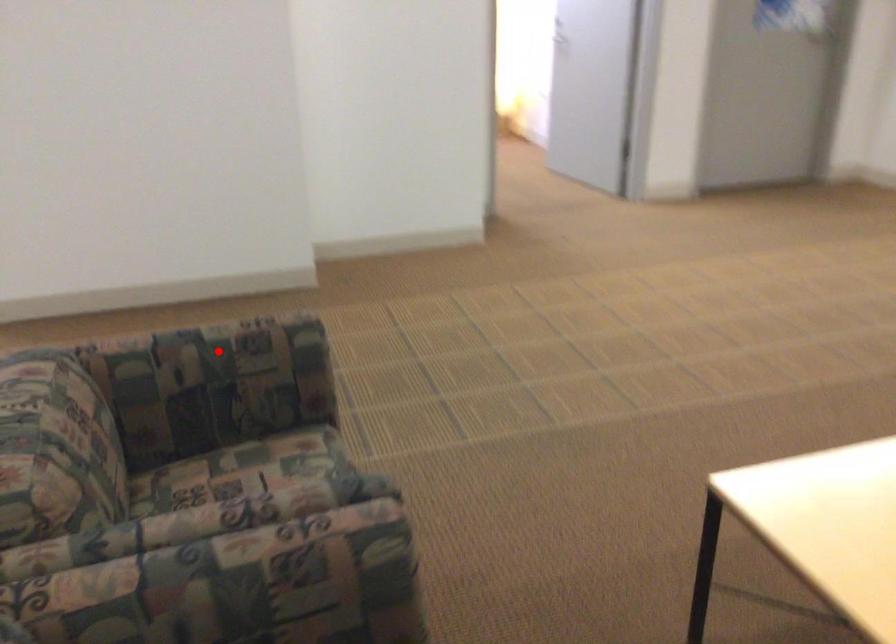
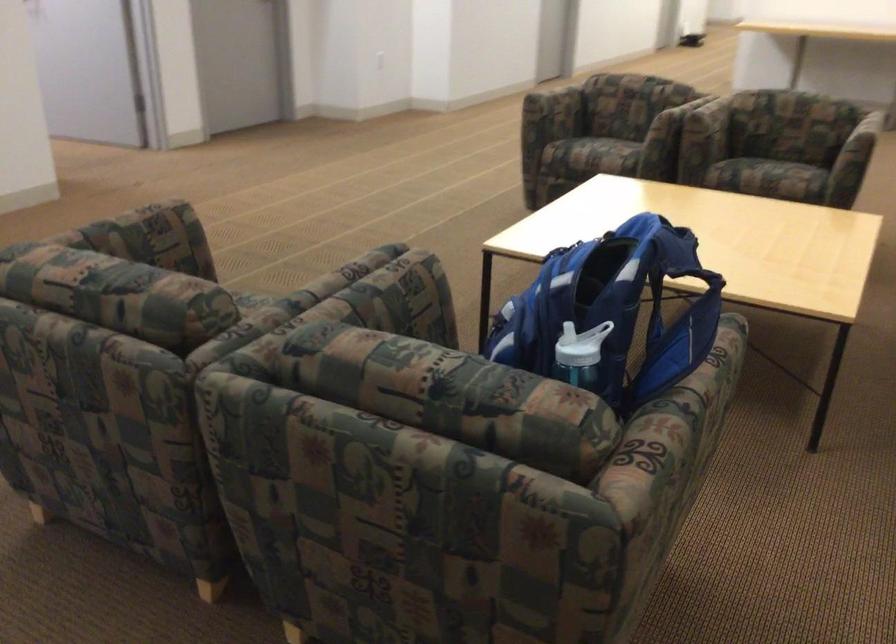
In the second image, find the point that corresponds to the highlighted location in the first image.

(141, 232)